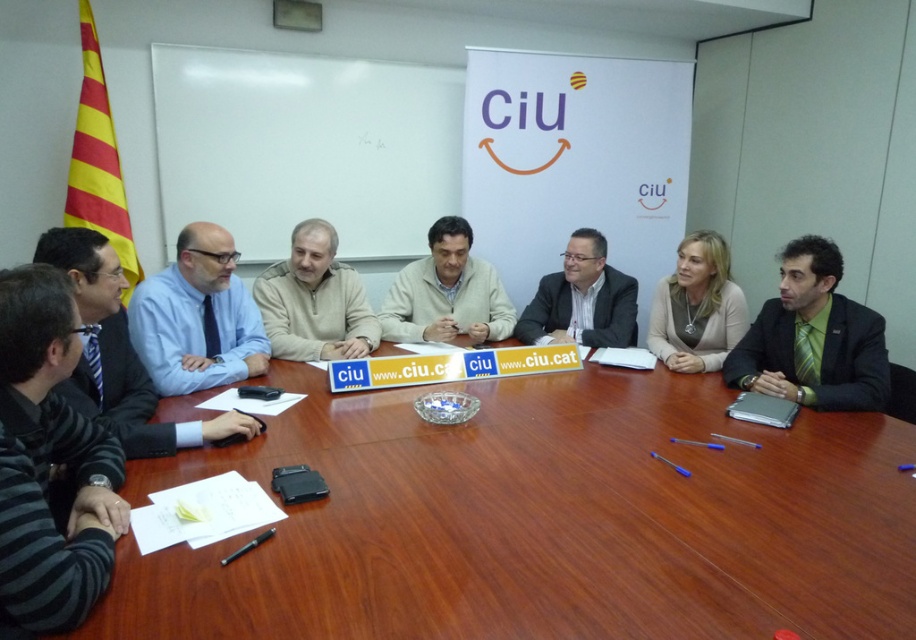
Does green striped tie at right have a greater width compared to blue shirt at left?

Indeed, green striped tie at right has a greater width compared to blue shirt at left.

Is point (838, 353) closer to camera compared to point (204, 268)?

No.

This screenshot has width=916, height=640. I want to click on green striped tie at right, so click(813, 339).

Between striped sweater at left and light beige sweater at center, which one appears on the right side from the viewer's perspective?

From the viewer's perspective, light beige sweater at center appears more on the right side.

Is striped sweater at left to the right of light beige sweater at center from the viewer's perspective?

No, striped sweater at left is not to the right of light beige sweater at center.

What do you see at coordinates (49, 464) in the screenshot?
I see `striped sweater at left` at bounding box center [49, 464].

Find the location of a particular element. striped sweater at left is located at coordinates (49, 464).

Is point (804, 344) closer to camera compared to point (677, 342)?

That is True.

Image resolution: width=916 pixels, height=640 pixels. What do you see at coordinates (813, 339) in the screenshot?
I see `green striped tie at right` at bounding box center [813, 339].

Where is `green striped tie at right`? green striped tie at right is located at coordinates (813, 339).

The image size is (916, 640). In order to click on green striped tie at right in this screenshot , I will do (813, 339).